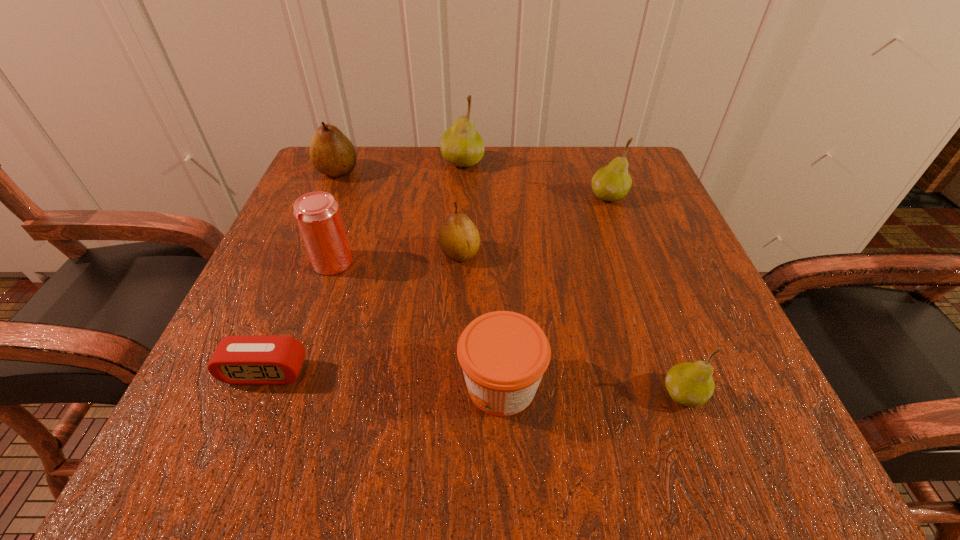
Image resolution: width=960 pixels, height=540 pixels. I want to click on free space between the tallest pear and the farther brown pear, so click(400, 167).

Identify the location of free point between the tallest object and the third farthest pear. This screenshot has width=960, height=540. (536, 179).

Find the location of a particular element. free space that is in between the biggest green pear and the right brown pear is located at coordinates (461, 208).

This screenshot has width=960, height=540. I want to click on vacant region between the jam and the third farthest object, so click(555, 291).

Find the location of a particular element. The image size is (960, 540). object that is the third closest to the right brown pear is located at coordinates (461, 145).

Identify the location of the second closest object to the nearest pear. This screenshot has width=960, height=540. (459, 239).

Locate which pear is the second closest to the beer can. Please provide its 2D coordinates. Your answer should be formatted as a tuple, i.e. [(x, y)], where the tuple contains the x and y coordinates of a point satisfying the conditions above.

[(331, 152)]

Select which pear is the second closest to the leftmost pear. Please provide its 2D coordinates. Your answer should be formatted as a tuple, i.e. [(x, y)], where the tuple contains the x and y coordinates of a point satisfying the conditions above.

[(459, 239)]

This screenshot has width=960, height=540. I want to click on green pear that stands as the closest to the second smallest green pear, so click(x=461, y=145).

Identify which green pear is located as the second nearest to the second biggest green pear. Please provide its 2D coordinates. Your answer should be formatted as a tuple, i.e. [(x, y)], where the tuple contains the x and y coordinates of a point satisfying the conditions above.

[(690, 384)]